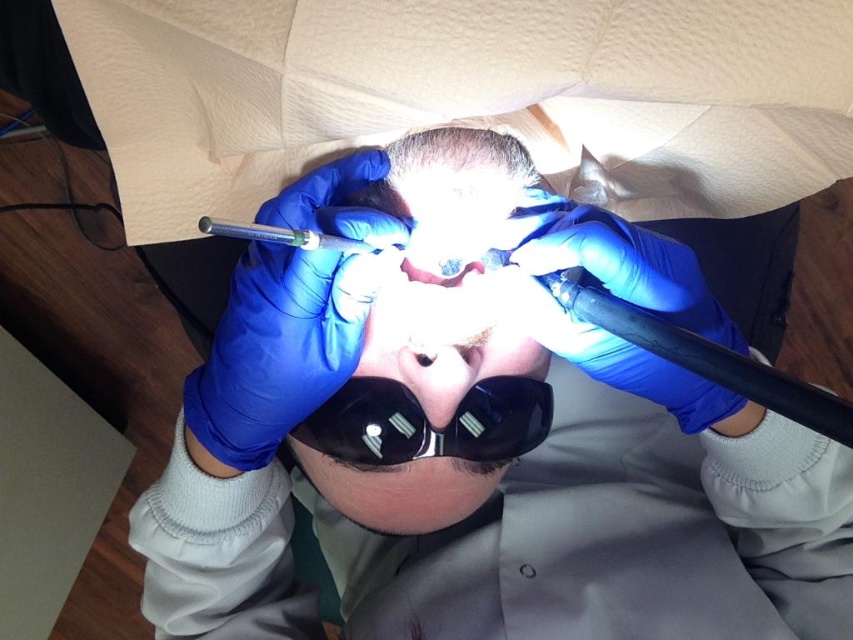
You are a dental assistant standing 1 meter away from the dental chair. You need to reach a specific point marked at coordinates point [444,419] to adjust a tool. Given that the distance from your eyes to the point is 47.47 centimeters, can you safely reach it without moving closer?

The distance from the viewer to point [444,419] is 47.47 centimeters. Since you are standing 1 meter away, which is farther than the point, you can safely reach it without moving closer.

You are a dental assistant standing at the point marked as point (438, 282). The dentist is performing a procedure on a patient. You need to hand the dentist a tool located 18 inches away from you. Can you reach the tool without moving from your current position?

The point (438, 282) and viewer are 18.05 inches apart from each other. Since the tool is located 18 inches away from you, you can reach it without moving from your current position as the distance is approximately the same.

You are a dental assistant observing the dentist performing a procedure. You need to hand the dentist a tool. The blue rubber gloves at center are closer to you than the pink rubber mouth at center. Which object should you reach for first to place the tool in the dentist hands?

The blue rubber gloves at center is closer to the viewer than the pink rubber mouth at center, so you should reach for the blue rubber gloves at center first to place the tool in the dentist hands.